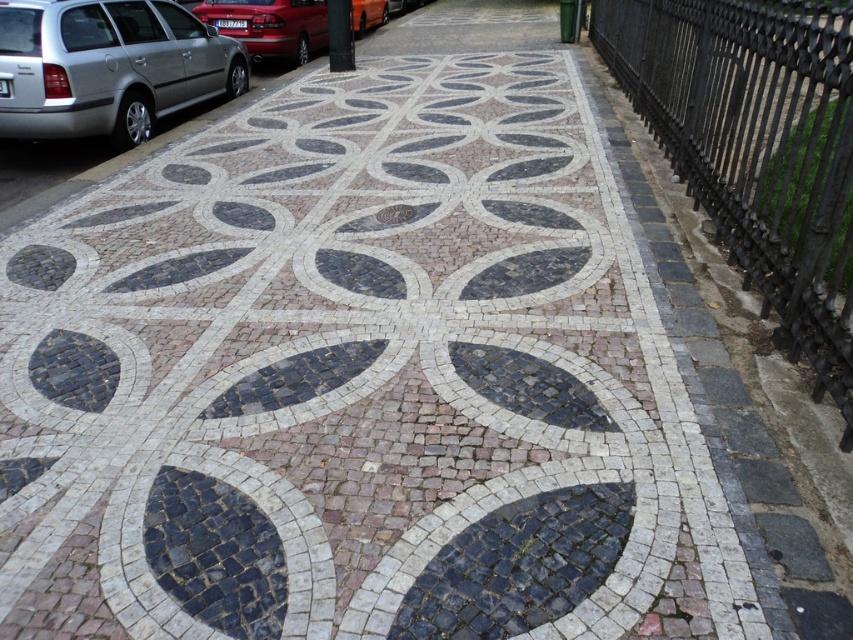
You are a delivery person trying to park your delivery van which is 2 meters wide. You see the black wrought iron fence at right and the silver metallic car at left. Is there enough space between them to park your van?

The black wrought iron fence at right is smaller than the silver metallic car at left, but the exact distance between them isn not provided. Without knowing the distance, it is impossible to determine if there is enough space for the van.

You are standing at the camera position looking at the cobblestone pathway. There are two points marked on the path, one at coordinates point (807,326) and the other at point (13,138). Which of these points is closer to you?

Point (807,326) is closer to the camera than point (13,138).

You are a delivery person trying to place a package on the pathway. The package is 1.2 meters wide. The dark gray mosaic leaf at center and the metallic red car at upper left are both on the pathway. Can the package fit between them without overlapping either?

The dark gray mosaic leaf at center is narrower than the metallic red car at upper left. Since the package is 1.2 meters wide, it depends on the actual dimensions of the objects. However, since the leaf is narrower, the space between them might be sufficient. But without exact measurements, it is uncertain. However, according to the description, the dark gray mosaic leaf at center is less wide than the metallic red car at upper left. Therefore, the space between them may be enough if the distance between is